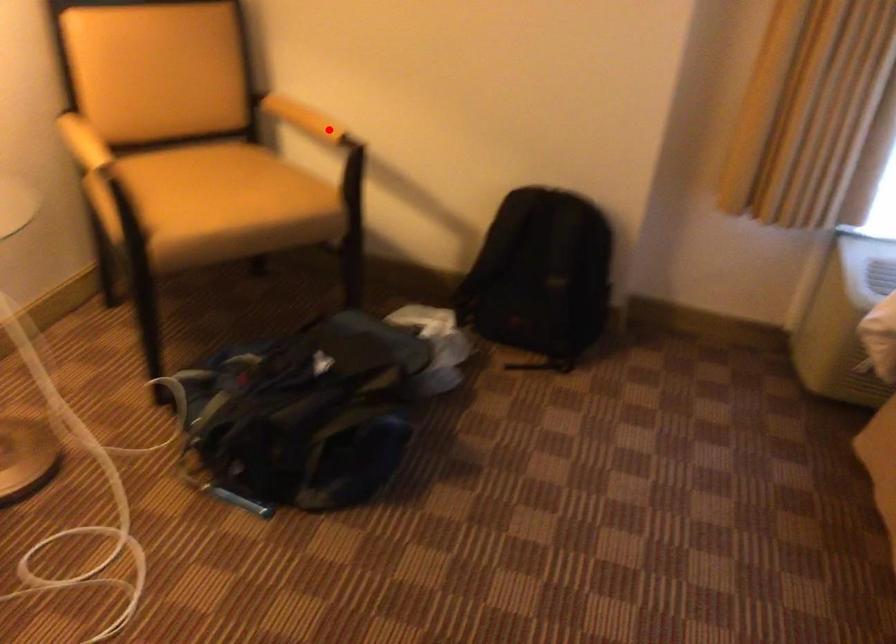
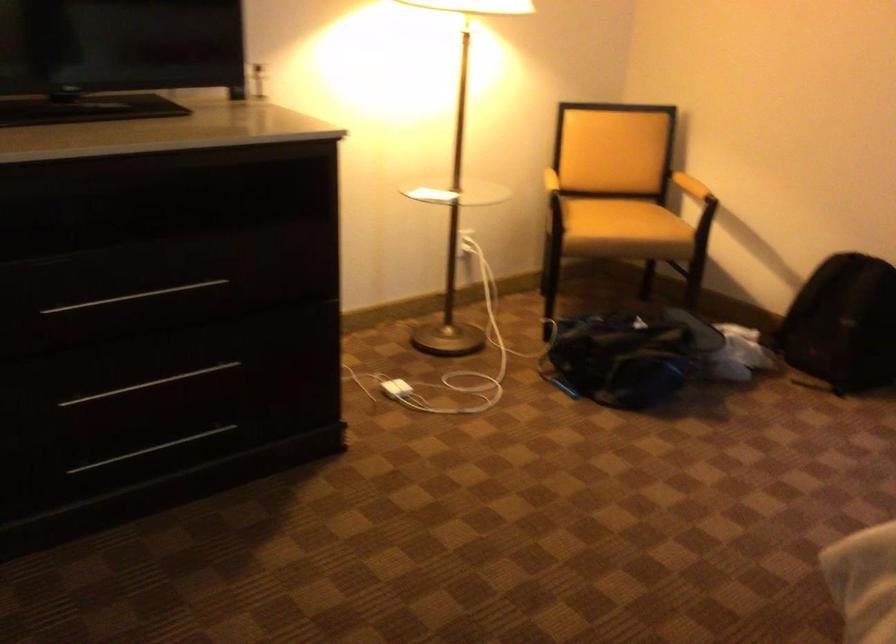
Question: I am providing you with two images of the same scene from different viewpoints. In image1, a red point is highlighted. Considering the same 3D point in image2, which of the following is correct?

Choices:
 (A) It is closer
 (B) It is farther

Answer: (B)